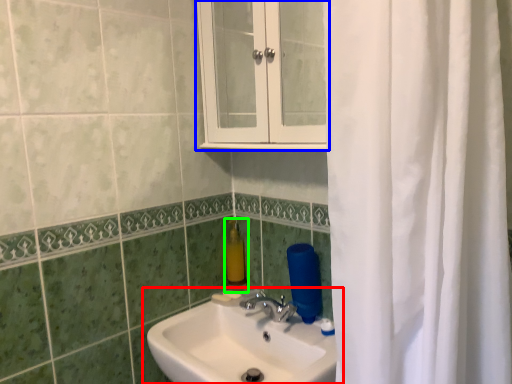
Question: Estimate the real-world distances between objects in this image. Which object is farther from sink (highlighted by a red box), medicine cabinet (highlighted by a blue box) or soap dispenser (highlighted by a green box)?

Choices:
 (A) medicine cabinet
 (B) soap dispenser

Answer: (A)